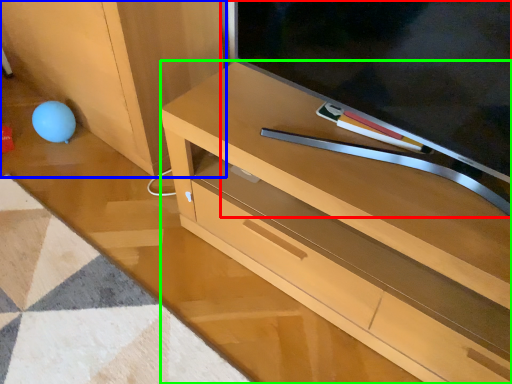
Question: Which object is positioned farthest from television (highlighted by a red box)? Select from cabinetry (highlighted by a blue box) and desk (highlighted by a green box).

Choices:
 (A) cabinetry
 (B) desk

Answer: (A)